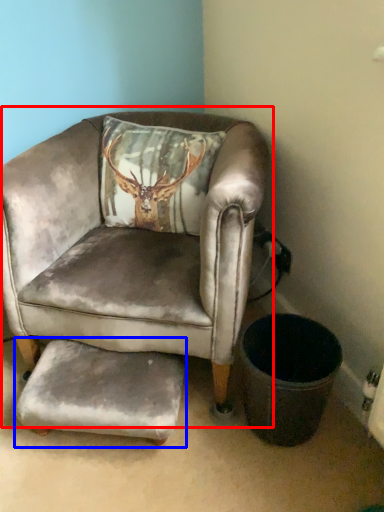
Question: Which object is closer to the camera taking this photo, chair (highlighted by a red box) or footrest (highlighted by a blue box)?

Choices:
 (A) chair
 (B) footrest

Answer: (A)